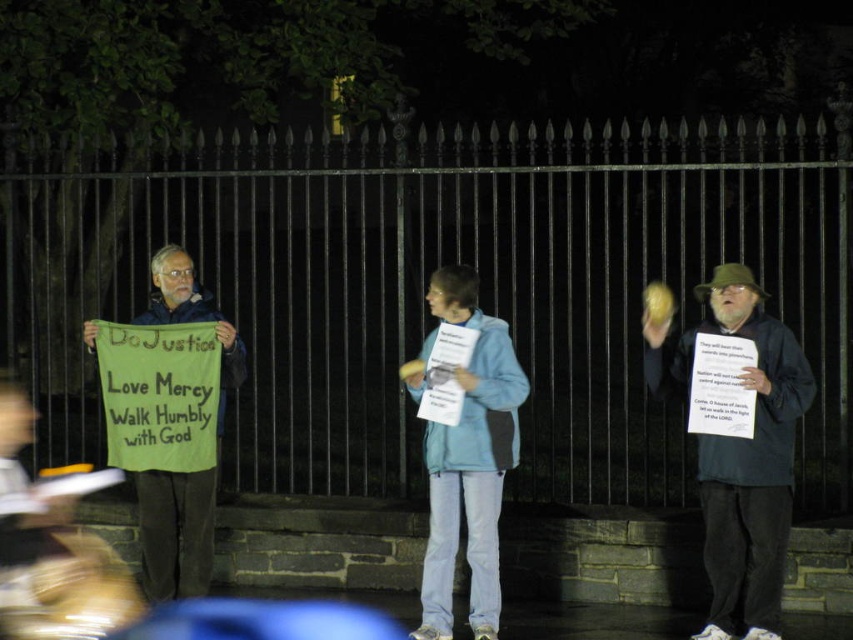
You are a photographer trying to capture both the blue fabric sign at right and the blue fabric sign at center in a single frame. Which sign should you focus on first to ensure both are in focus?

You should focus on the blue fabric sign at center first because it is farther away than the blue fabric sign at right. By focusing on the farther sign, the closer one will also be in focus due to the depth of field.

You are a photographer standing at the camera position. You want to focus your camera on one of the two points, point 1 at coordinates point [735,536] or point 2 at coordinates point [425,579]. Which point is closer to your camera?

Point [735,536] is closer to the camera than point [425,579].

From the picture: You are a photographer standing at the green fabric sign at left. You want to take a photo of the black metal fence at center without moving your position. Can you fit the entire fence in your camera frame if your camera has a maximum horizontal field of view of 15 feet?

The black metal fence at center is 19.51 feet away from the green fabric sign at left. Since the camera can only capture up to 15 feet horizontally, the fence is too far away to fit entirely within the frame without moving closer.